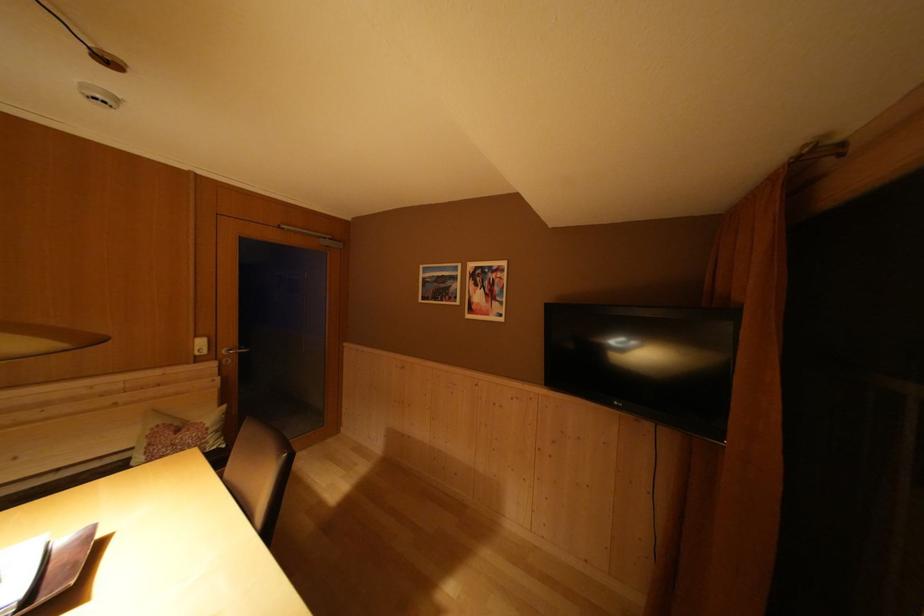
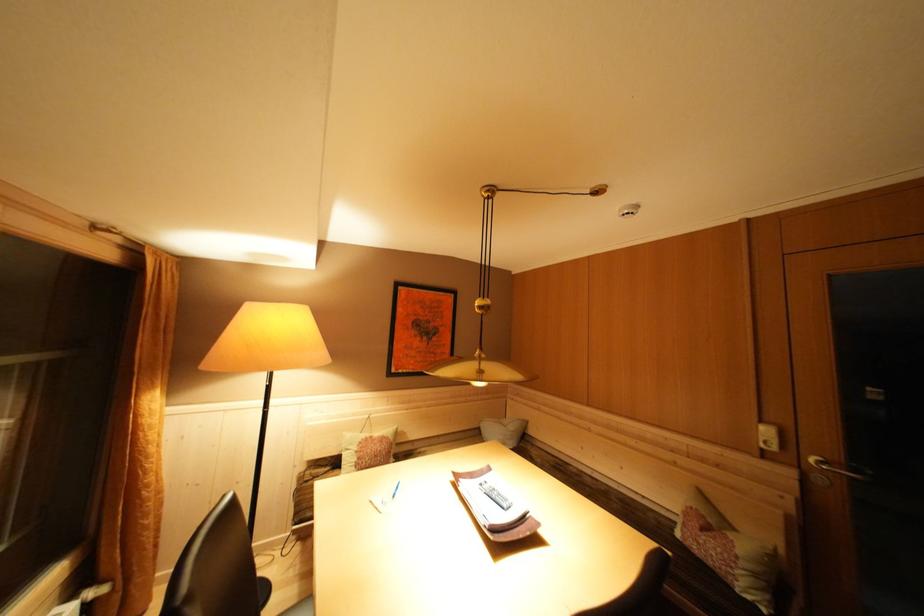
The point at [203,342] is marked in the first image. Where is the corresponding point in the second image?

(768, 427)